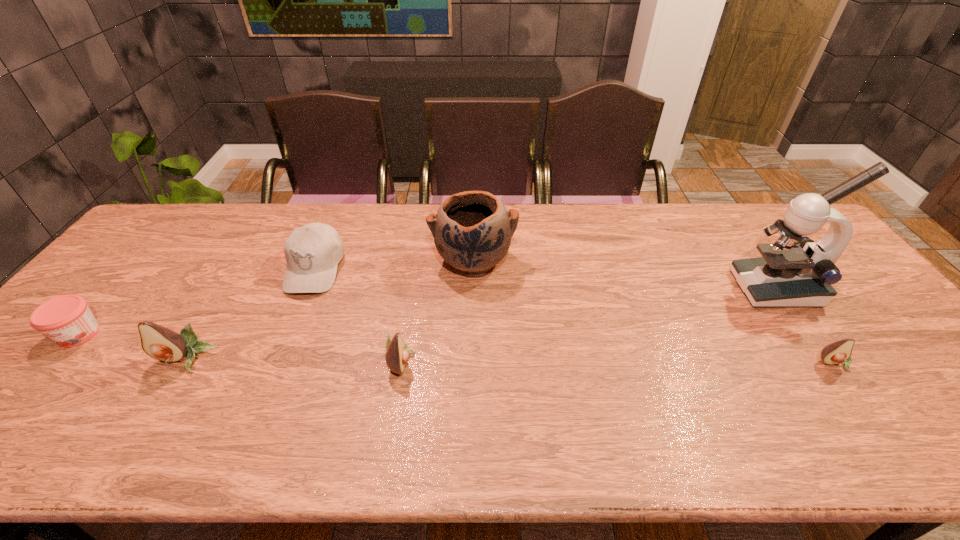
What are the coordinates of `the sixth object from right to left` in the screenshot? It's located at (161, 343).

The image size is (960, 540). Identify the location of the third tallest object. (161, 343).

The width and height of the screenshot is (960, 540). I want to click on the second tallest avocado, so click(397, 355).

Where is `the fourth object from left to right`? The image size is (960, 540). the fourth object from left to right is located at coordinates (397, 355).

Find the location of a particular element. the rightmost avocado is located at coordinates (838, 352).

Locate an element on the screen. The width and height of the screenshot is (960, 540). the fifth object from left to right is located at coordinates (472, 230).

What are the coordinates of `pottery` in the screenshot? It's located at (472, 230).

At what (x,y) coordinates should I click in order to perform the action: click on jam. Please return your answer as a coordinate pair (x, y). The height and width of the screenshot is (540, 960). Looking at the image, I should click on (67, 320).

Find the location of a particular element. The image size is (960, 540). the third object from left to right is located at coordinates (313, 251).

Image resolution: width=960 pixels, height=540 pixels. In order to click on microscope in this screenshot , I will do `click(795, 271)`.